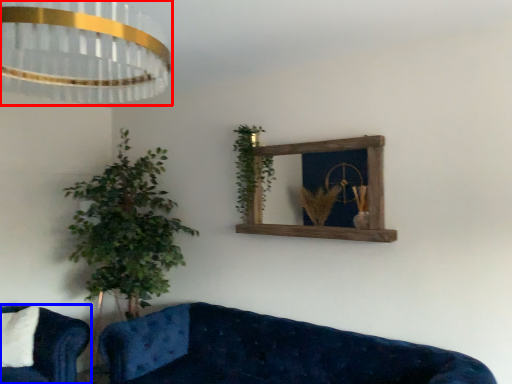
Question: Among these objects, which one is nearest to the camera, lamp (highlighted by a red box) or studio couch (highlighted by a blue box)?

Choices:
 (A) lamp
 (B) studio couch

Answer: (A)